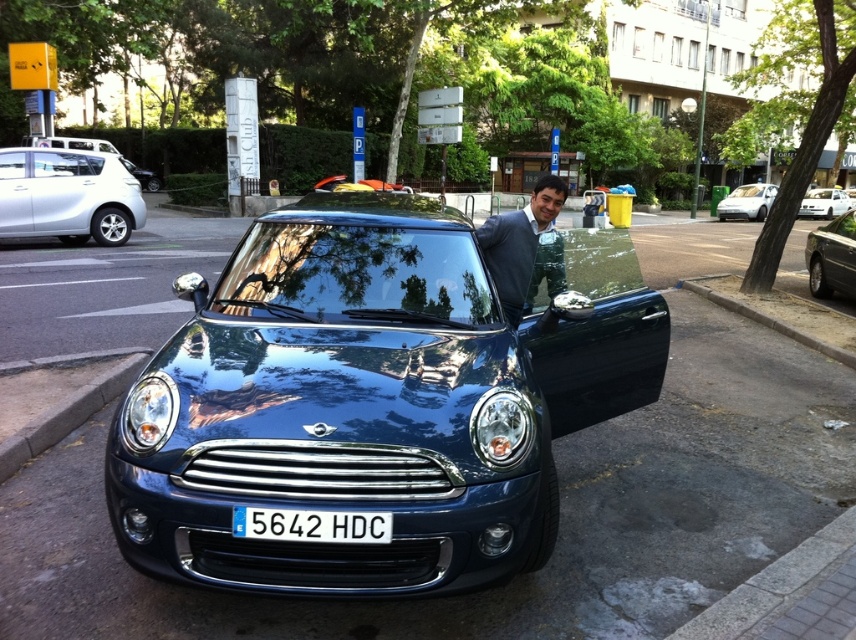
Can you confirm if silver metallic hatchback at left is thinner than white glossy sedan at upper right?

Yes, silver metallic hatchback at left is thinner than white glossy sedan at upper right.

Does silver metallic hatchback at left have a lesser height compared to white glossy sedan at upper right?

Indeed, silver metallic hatchback at left has a lesser height compared to white glossy sedan at upper right.

This screenshot has height=640, width=856. What do you see at coordinates (67, 196) in the screenshot?
I see `silver metallic hatchback at left` at bounding box center [67, 196].

Find the location of a particular element. The width and height of the screenshot is (856, 640). silver metallic hatchback at left is located at coordinates (67, 196).

Between smooth concrete curb at lower left and metallic silver sedan at right, which one has less height?

smooth concrete curb at lower left

Locate an element on the screen. smooth concrete curb at lower left is located at coordinates (66, 413).

Can you confirm if metallic silver sedan at right is positioned to the left of white glossy sedan at upper right?

Indeed, metallic silver sedan at right is positioned on the left side of white glossy sedan at upper right.

Is metallic silver sedan at right above white glossy sedan at upper right?

Actually, metallic silver sedan at right is below white glossy sedan at upper right.

Where is `metallic silver sedan at right`? The height and width of the screenshot is (640, 856). metallic silver sedan at right is located at coordinates (831, 257).